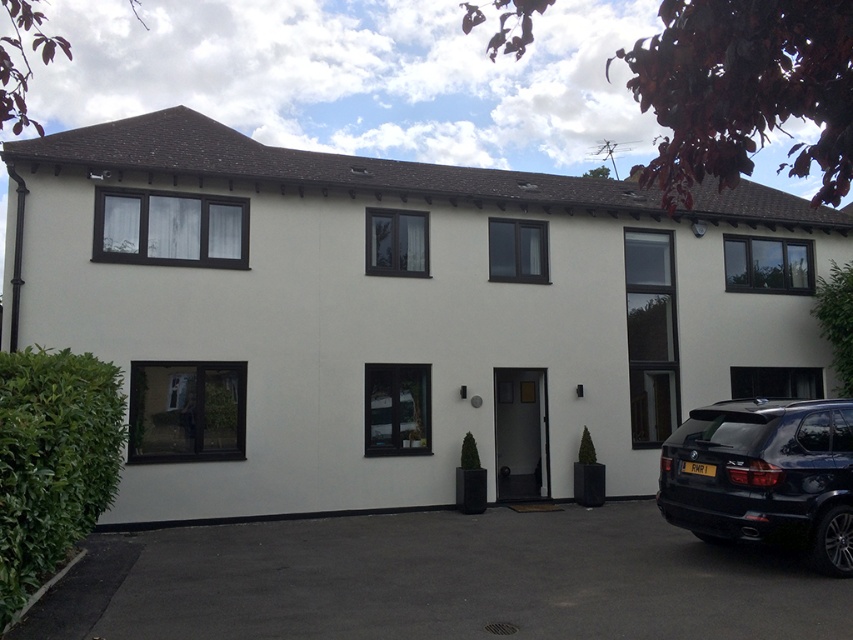
Question: Can you confirm if black asphalt driveway at lower center is positioned to the right of black glossy suv at lower right?

Choices:
 (A) yes
 (B) no

Answer: (B)

Question: Which object is positioned closest to the black glossy suv at lower right?

Choices:
 (A) black asphalt driveway at lower center
 (B) green leafy bush at lower left

Answer: (A)

Question: Is black glossy suv at lower right to the left of green leafy bush at lower left from the viewer's perspective?

Choices:
 (A) no
 (B) yes

Answer: (A)

Question: Which object appears closest to the camera in this image?

Choices:
 (A) black glossy suv at lower right
 (B) black asphalt driveway at lower center
 (C) green leafy bush at lower left

Answer: (C)

Question: Does black asphalt driveway at lower center appear over green leafy bush at lower left?

Choices:
 (A) no
 (B) yes

Answer: (A)

Question: Which of these objects is positioned farthest from the black glossy suv at lower right?

Choices:
 (A) black asphalt driveway at lower center
 (B) green leafy bush at lower left

Answer: (B)